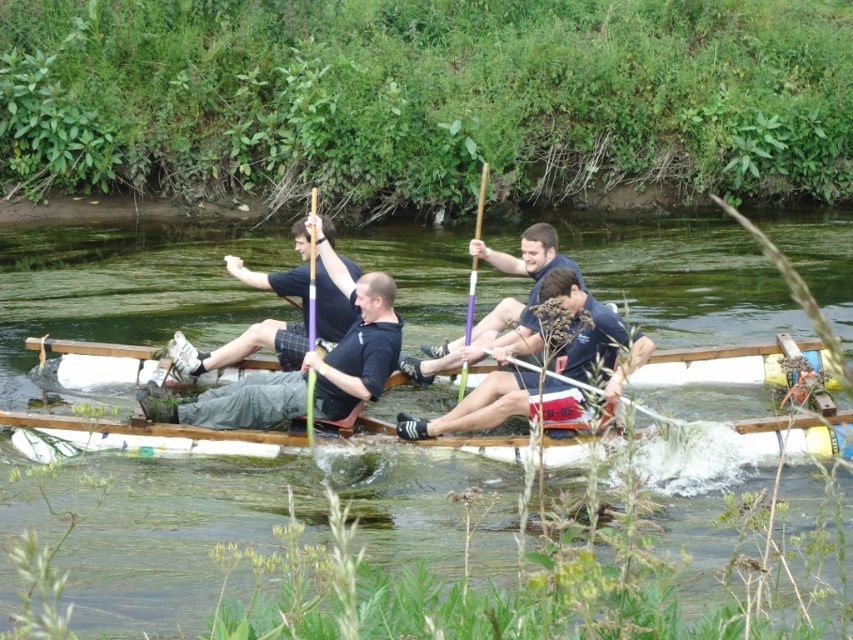
Who is higher up, white plastic boat at center or white plastic paddle at center?

white plastic paddle at center is higher up.

In the scene shown: Can you confirm if white plastic boat at center is positioned below white plastic paddle at center?

Correct, white plastic boat at center is located below white plastic paddle at center.

Who is more distant from viewer, (164, 433) or (602, 396)?

Point (164, 433)

Identify the location of white plastic boat at center. (714, 365).

Does blue fabric rower at center appear on the left side of black matte shirt at center?

In fact, blue fabric rower at center is to the right of black matte shirt at center.

Is blue fabric rower at center smaller than black matte shirt at center?

Incorrect, blue fabric rower at center is not smaller in size than black matte shirt at center.

Which is behind, point (476, 394) or point (218, 417)?

The point (476, 394) is more distant.

Find the location of a particular element. Image resolution: width=853 pixels, height=640 pixels. blue fabric rower at center is located at coordinates (549, 365).

Which of these two, green translucent water at center or blue fabric rower at center, stands taller?

Standing taller between the two is green translucent water at center.

Can you confirm if green translucent water at center is wider than blue fabric rower at center?

Indeed, green translucent water at center has a greater width compared to blue fabric rower at center.

Who is more distant from viewer, [78,390] or [479,404]?

Positioned behind is point [78,390].

Find the location of a particular element. The image size is (853, 640). green translucent water at center is located at coordinates (122, 291).